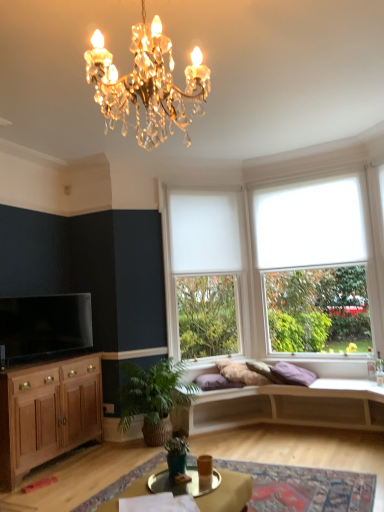
Question: Is white roller blind at right not within white matte studio couch at center?

Choices:
 (A) no
 (B) yes

Answer: (B)

Question: Can you confirm if white roller blind at right is thinner than white matte studio couch at center?

Choices:
 (A) yes
 (B) no

Answer: (A)

Question: From a real-world perspective, is white roller blind at right positioned under white matte studio couch at center based on gravity?

Choices:
 (A) yes
 (B) no

Answer: (B)

Question: Does white roller blind at right appear on the left side of white matte studio couch at center?

Choices:
 (A) yes
 (B) no

Answer: (B)

Question: Considering the relative sizes of white roller blind at right and white matte studio couch at center in the image provided, is white roller blind at right bigger than white matte studio couch at center?

Choices:
 (A) yes
 (B) no

Answer: (B)

Question: In terms of size, does purple cotton pillow at center appear bigger or smaller than wooden cabinet at lower left?

Choices:
 (A) big
 (B) small

Answer: (B)

Question: From a real-world perspective, is purple cotton pillow at center positioned above or below wooden cabinet at lower left?

Choices:
 (A) below
 (B) above

Answer: (B)

Question: In the image, is purple cotton pillow at center positioned in front of or behind wooden cabinet at lower left?

Choices:
 (A) behind
 (B) front

Answer: (A)

Question: In terms of width, does purple cotton pillow at center look wider or thinner when compared to wooden cabinet at lower left?

Choices:
 (A) thin
 (B) wide

Answer: (B)

Question: Is white matte blind at upper center taller or shorter than metallic gold tray at lower center?

Choices:
 (A) tall
 (B) short

Answer: (A)

Question: Relative to metallic gold tray at lower center, is white matte blind at upper center in front or behind?

Choices:
 (A) front
 (B) behind

Answer: (B)

Question: From a real-world perspective, is white matte blind at upper center above or below metallic gold tray at lower center?

Choices:
 (A) above
 (B) below

Answer: (A)

Question: Which is correct: white matte blind at upper center is inside metallic gold tray at lower center, or outside of it?

Choices:
 (A) outside
 (B) inside

Answer: (A)

Question: Considering the positions of green matte plant at lower center, marked as the first houseplant in a front-to-back arrangement, and green leafy plant at lower center, the first houseplant when ordered from back to front, in the image, is green matte plant at lower center, marked as the first houseplant in a front-to-back arrangement, taller or shorter than green leafy plant at lower center, the first houseplant when ordered from back to front,?

Choices:
 (A) short
 (B) tall

Answer: (A)

Question: Do you think green matte plant at lower center, acting as the second houseplant starting from the back, is within green leafy plant at lower center, positioned as the second houseplant in front-to-back order, or outside of it?

Choices:
 (A) outside
 (B) inside

Answer: (A)